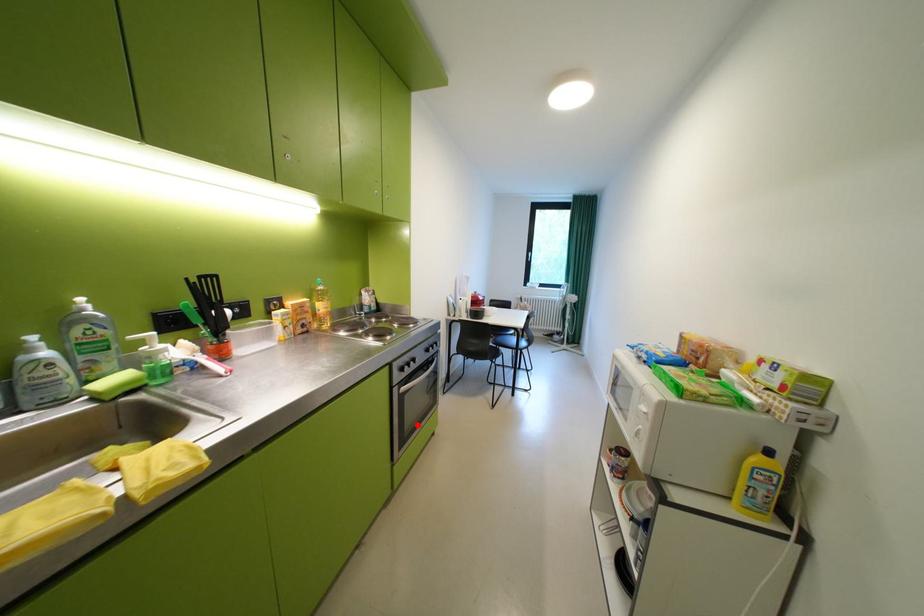
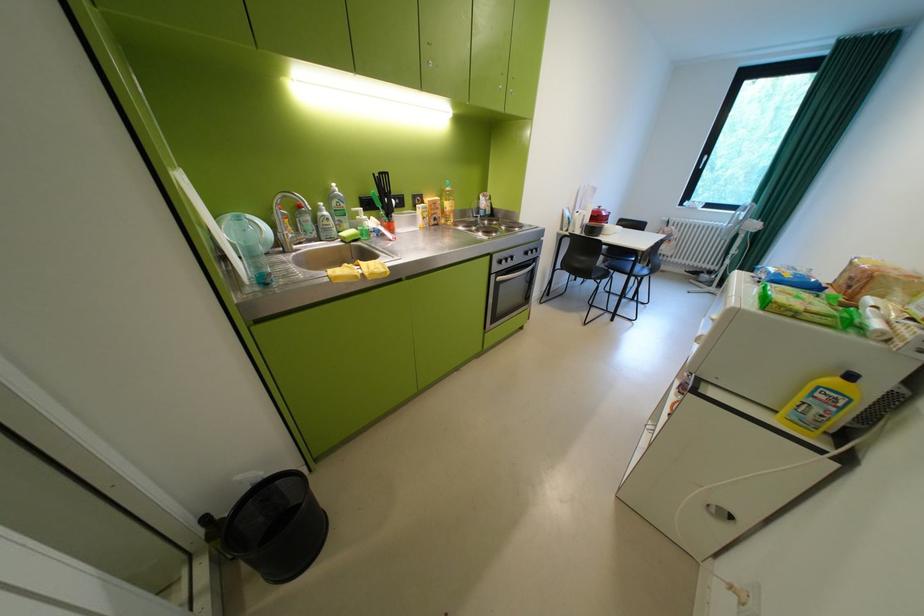
Question: I am providing you with two images of the same scene from different viewpoints. A red point is shown in image1. For the corresponding object point in image2, is it positioned nearer or farther from the camera?

Choices:
 (A) Nearer
 (B) Farther

Answer: (B)